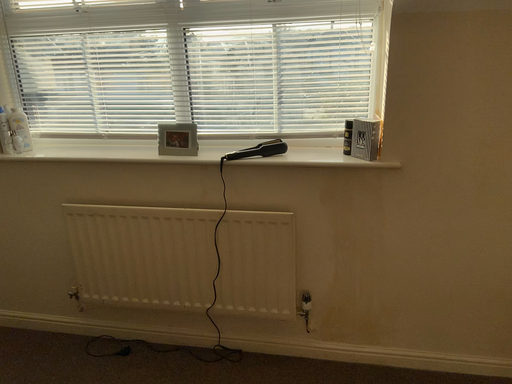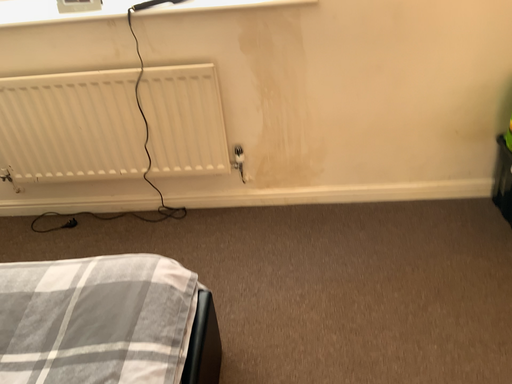
Question: How did the camera likely rotate when shooting the video?

Choices:
 (A) rotated upward
 (B) rotated downward

Answer: (B)